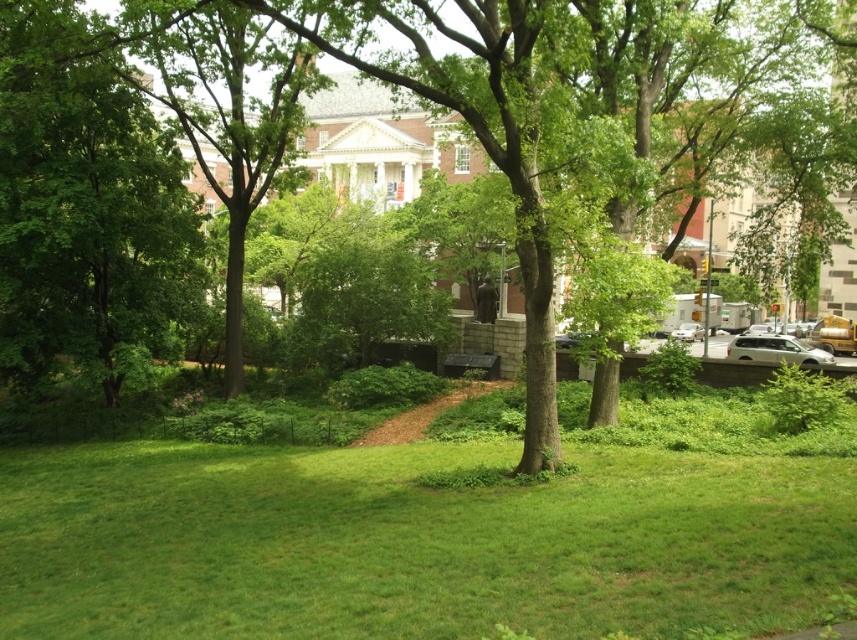
Who is shorter, green leafy tree at center or white matte car at right?

white matte car at right is shorter.

Which is behind, point (144, 4) or point (799, 348)?

Point (799, 348)

What are the coordinates of `green leafy tree at center` in the screenshot? It's located at (318, 84).

Which of these two, white matte car at right or silver metallic sedan at center-right, stands shorter?

Standing shorter between the two is white matte car at right.

Find the location of a particular element. The width and height of the screenshot is (857, 640). white matte car at right is located at coordinates (776, 349).

Where is `white matte car at right`? The image size is (857, 640). white matte car at right is located at coordinates (776, 349).

Is point (201, 45) farther from camera compared to point (694, 330)?

That is False.

Can you confirm if green leafy tree at center is taller than silver metallic sedan at center-right?

Indeed, green leafy tree at center has a greater height compared to silver metallic sedan at center-right.

The image size is (857, 640). Describe the element at coordinates (318, 84) in the screenshot. I see `green leafy tree at center` at that location.

Find the location of a particular element. green leafy tree at center is located at coordinates (318, 84).